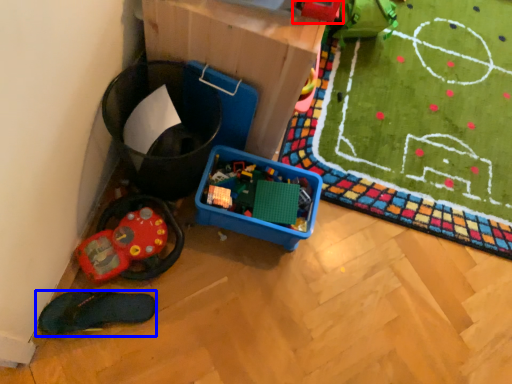
Question: Which object appears farthest to the camera in this image, toy (highlighted by a red box) or footwear (highlighted by a blue box)?

Choices:
 (A) toy
 (B) footwear

Answer: (B)